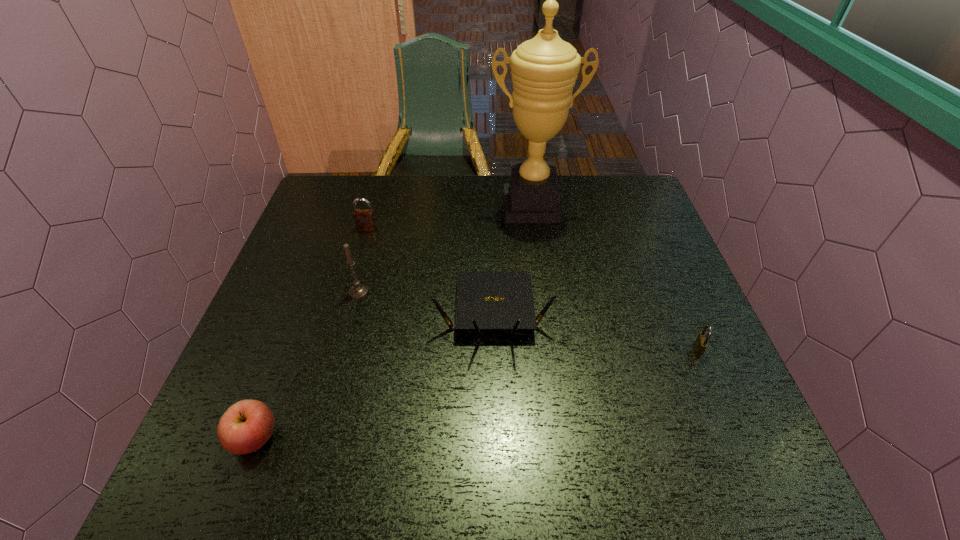
Find the location of a particular element. trophy cup is located at coordinates (544, 69).

Locate an element on the screen. The image size is (960, 540). the farthest object is located at coordinates (544, 69).

I want to click on candle, so click(358, 290).

Find the location of a particular element. This screenshot has width=960, height=540. router is located at coordinates (485, 301).

This screenshot has width=960, height=540. Find the location of `the second farthest object`. the second farthest object is located at coordinates (364, 218).

Find the location of `the taller padlock`. the taller padlock is located at coordinates (364, 218).

The image size is (960, 540). What are the coordinates of `apple` in the screenshot? It's located at (247, 425).

This screenshot has height=540, width=960. I want to click on the leftmost object, so click(x=247, y=425).

The image size is (960, 540). What are the coordinates of `the shorter padlock` in the screenshot? It's located at (700, 344).

At what (x,y) coordinates should I click in order to perform the action: click on the rightmost object. Please return your answer as a coordinate pair (x, y). The height and width of the screenshot is (540, 960). Looking at the image, I should click on (700, 344).